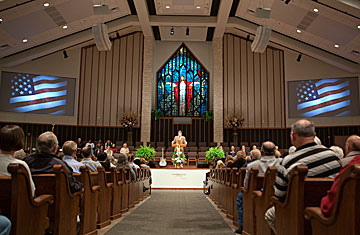
The image size is (360, 235). In order to click on recessed lighting in this screenshot , I will do `click(48, 4)`, `click(24, 41)`, `click(0, 20)`, `click(64, 28)`, `click(169, 6)`, `click(198, 8)`, `click(318, 10)`, `click(298, 30)`, `click(337, 46)`, `click(358, 26)`.